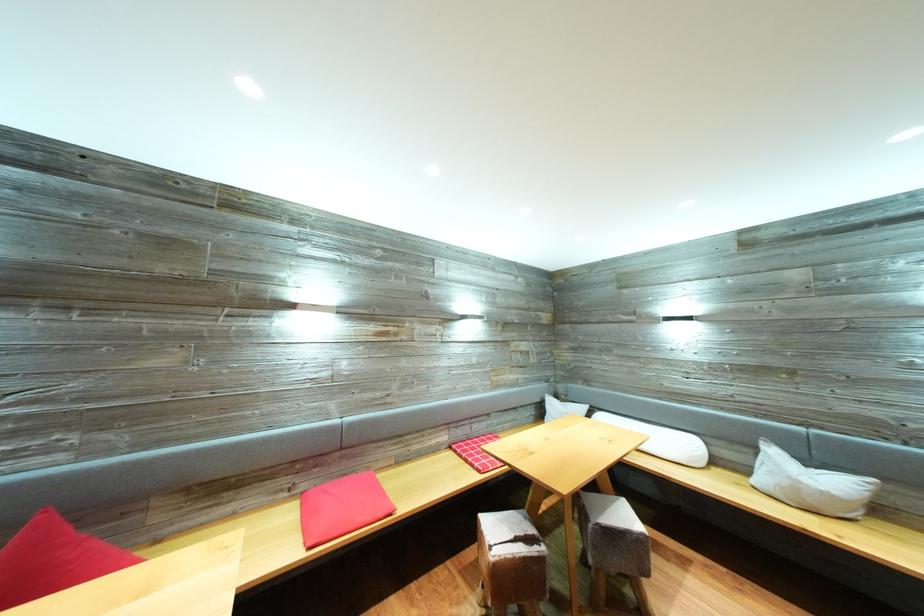
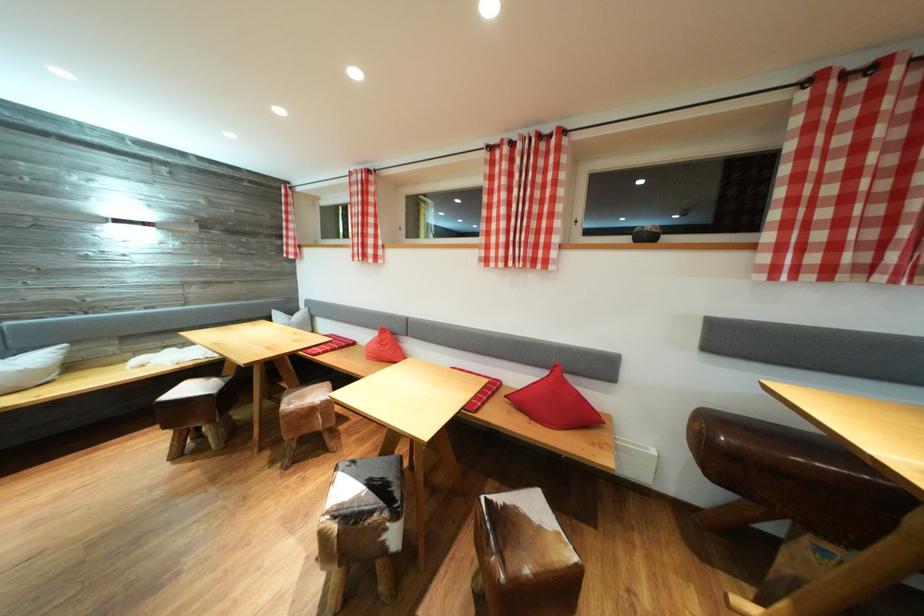
In the second image, find the point that corresponds to (x=817, y=468) in the first image.

(14, 358)